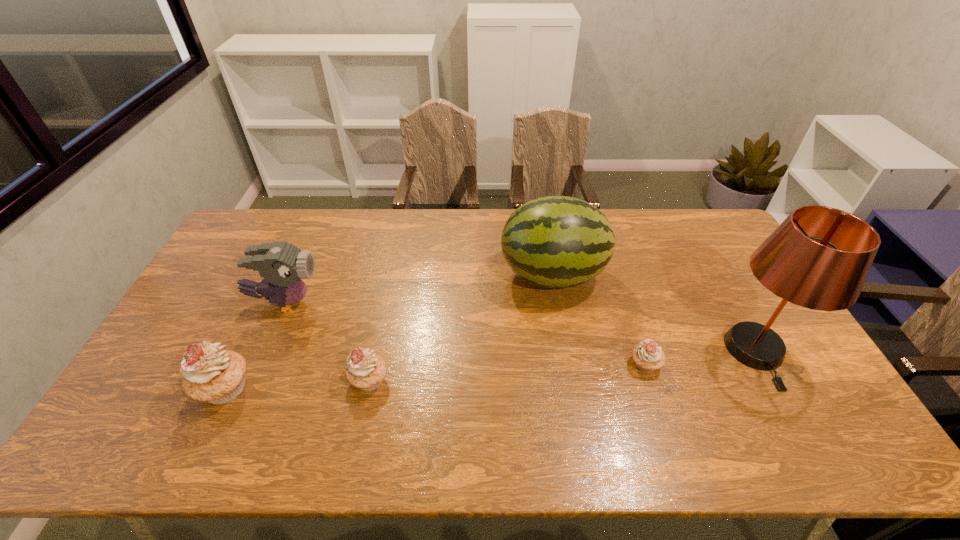
Locate an element on the screen. blank area in the image that satisfies the following two spatial constraints: 1. on the back side of the fifth tallest object; 2. at the beak of the bird is located at coordinates (385, 302).